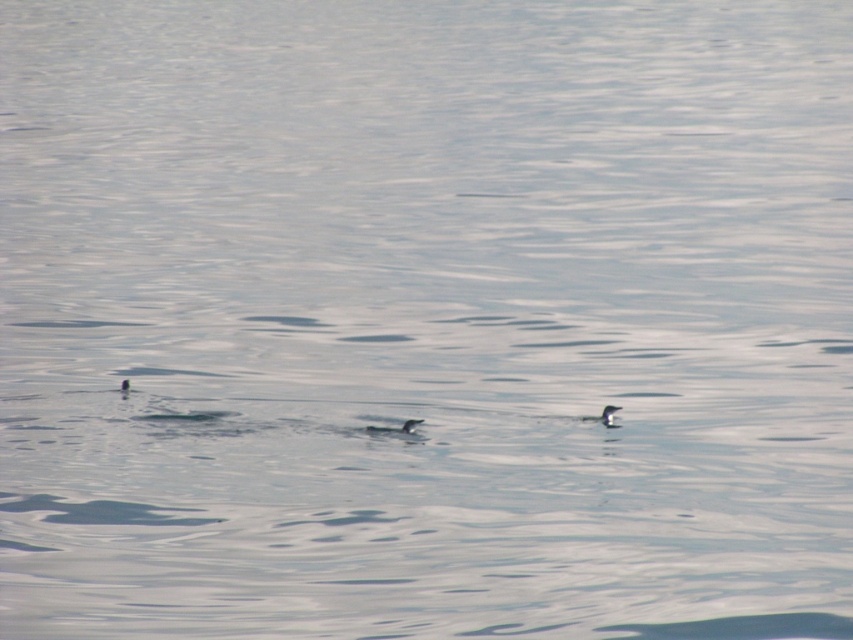
Question: In this image, where is black glossy penguin at center located relative to white matte bird at center?

Choices:
 (A) right
 (B) left

Answer: (B)

Question: Does black glossy penguin at center appear over white matte bird at center?

Choices:
 (A) no
 (B) yes

Answer: (A)

Question: Which point appears closest to the camera in this image?

Choices:
 (A) (607, 406)
 (B) (404, 433)

Answer: (B)

Question: Which point is closer to the camera?

Choices:
 (A) (380, 426)
 (B) (614, 412)

Answer: (B)

Question: Which point is closer to the camera taking this photo?

Choices:
 (A) (610, 422)
 (B) (374, 426)

Answer: (A)

Question: Is black glossy penguin at center below white matte bird at center?

Choices:
 (A) yes
 (B) no

Answer: (A)